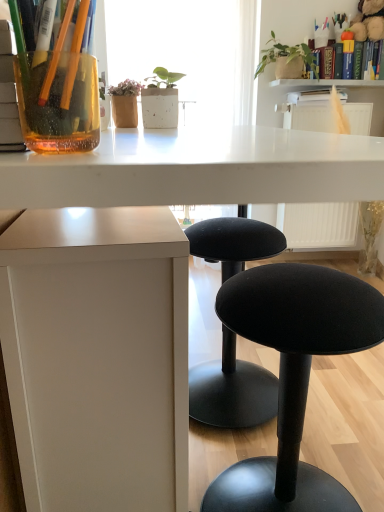
Question: Considering their positions, is white plastic radiator at upper right located in front of or behind green matte plant at upper right?

Choices:
 (A) behind
 (B) front

Answer: (B)

Question: Considering the relative positions of white plastic radiator at upper right and green matte plant at upper right in the image provided, is white plastic radiator at upper right to the left or to the right of green matte plant at upper right?

Choices:
 (A) left
 (B) right

Answer: (B)

Question: Which of these objects is positioned farthest from the white textured shelf at upper center?

Choices:
 (A) translucent orange glass at upper left
 (B) black fabric stool at lower right
 (C) hardcover book at upper right, the first book from the right
 (D) green matte plant at upper right
 (E) white plastic radiator at upper right

Answer: (A)

Question: Which of these objects is positioned farthest from the white textured shelf at upper center?

Choices:
 (A) white plastic radiator at upper right
 (B) hardcover book at upper center, the 1th book in the bottom-to-top sequence
 (C) translucent orange glass at upper left
 (D) green matte plant at upper right
 (E) black fabric stool at lower right

Answer: (C)